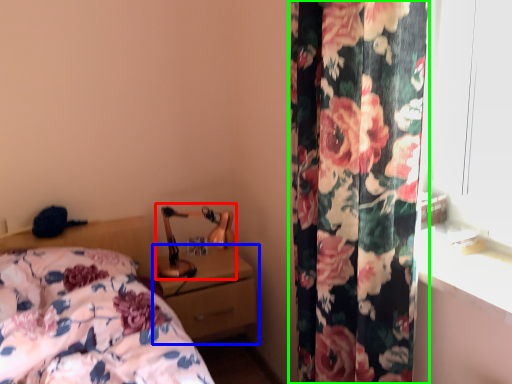
Question: Based on their relative distances, which object is nearer to table lamp (highlighted by a red box)? Choose from nightstand (highlighted by a blue box) and curtain (highlighted by a green box).

Choices:
 (A) nightstand
 (B) curtain

Answer: (A)